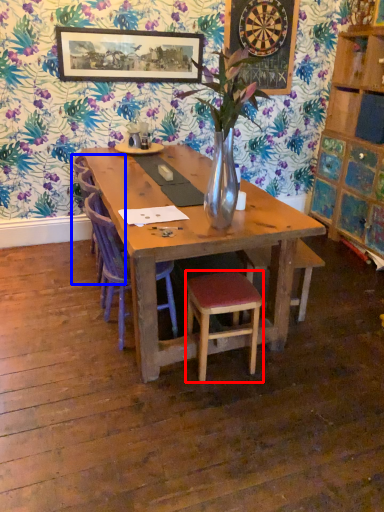
Question: Which of the following is the closest to the observer, stool (highlighted by a red box) or armchair (highlighted by a blue box)?

Choices:
 (A) stool
 (B) armchair

Answer: (A)